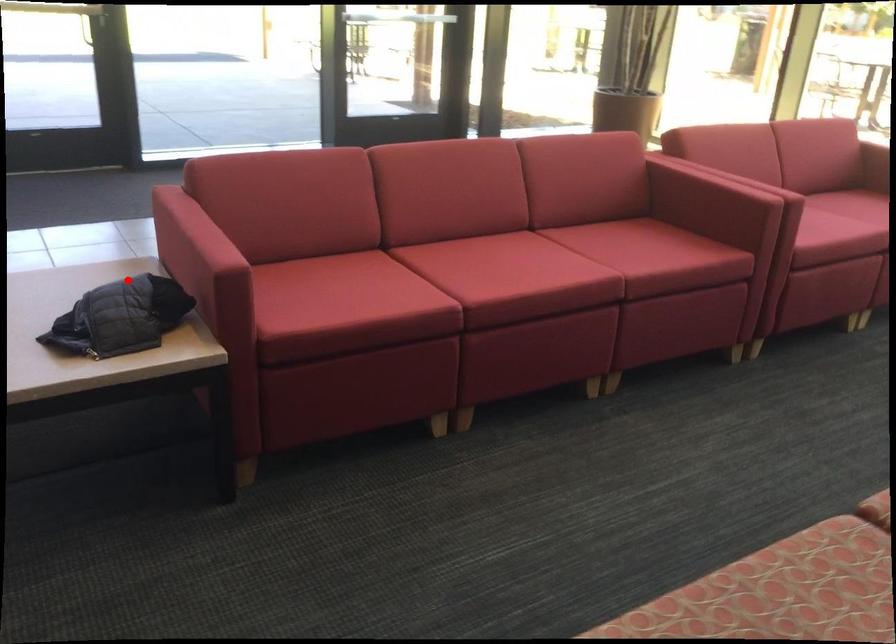
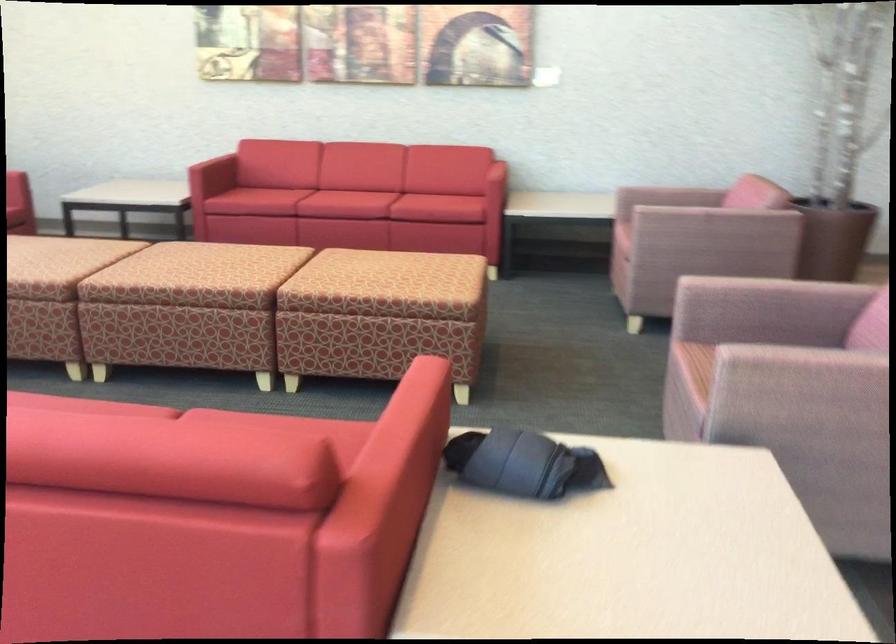
Question: A red point is marked in image1. In image2, is the corresponding 3D point closer to the camera or farther? Reply with the corresponding letter.

Choices:
 (A) The corresponding 3D point is closer.
 (B) The corresponding 3D point is farther.

Answer: (A)